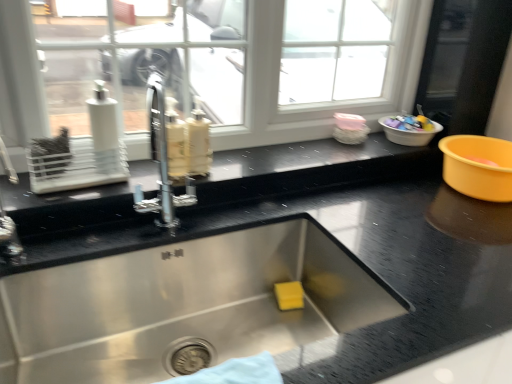
Locate an element on the screen. This screenshot has height=384, width=512. black granite countertop at center is located at coordinates (328, 230).

What do you see at coordinates (328, 230) in the screenshot? This screenshot has width=512, height=384. I see `black granite countertop at center` at bounding box center [328, 230].

Locate an element on the screen. This screenshot has height=384, width=512. white plastic basin at upper right is located at coordinates click(x=409, y=134).

What do you see at coordinates (409, 134) in the screenshot? I see `white plastic basin at upper right` at bounding box center [409, 134].

Identify the location of black granite countertop at center. Image resolution: width=512 pixels, height=384 pixels. (328, 230).

Considering the positions of objects black granite countertop at center and white plastic basin at upper right in the image provided, who is more to the right, black granite countertop at center or white plastic basin at upper right?

From the viewer's perspective, white plastic basin at upper right appears more on the right side.

Does black granite countertop at center come in front of white plastic basin at upper right?

That is True.

Considering the positions of points (304, 204) and (426, 136), is point (304, 204) closer to camera compared to point (426, 136)?

Yes.

From the image's perspective, which is above, black granite countertop at center or white plastic basin at upper right?

white plastic basin at upper right appears higher in the image.

From a real-world perspective, which is physically above, black granite countertop at center or white plastic basin at upper right?

From a 3D spatial view, white plastic basin at upper right is above.

Based on the photo, looking at their sizes, would you say black granite countertop at center is wider or thinner than white plastic basin at upper right?

Considering their sizes, black granite countertop at center looks broader than white plastic basin at upper right.

Considering the sizes of objects black granite countertop at center and white plastic basin at upper right in the image provided, who is shorter, black granite countertop at center or white plastic basin at upper right?

white plastic basin at upper right.

Looking at the image, does black granite countertop at center seem bigger or smaller compared to white plastic basin at upper right?

Considering their sizes, black granite countertop at center takes up more space than white plastic basin at upper right.

Would you say black granite countertop at center contains white plastic basin at upper right?

Actually, white plastic basin at upper right is outside black granite countertop at center.

Is black granite countertop at center far from white plastic basin at upper right?

black granite countertop at center is near white plastic basin at upper right, not far away.

Is black granite countertop at center facing away from white plastic basin at upper right?

No, black granite countertop at center is not facing away from white plastic basin at upper right.

How many degrees apart are the facing directions of black granite countertop at center and white plastic basin at upper right?

The angular difference between black granite countertop at center and white plastic basin at upper right is 0.895 degrees.

I want to click on countertop below the white plastic basin at upper right (from the image's perspective), so click(328, 230).

Is white plastic basin at upper right at the right side of black granite countertop at center?

Correct, you'll find white plastic basin at upper right to the right of black granite countertop at center.

From the picture: Considering the relative positions of white plastic basin at upper right and black granite countertop at center in the image provided, is white plastic basin at upper right in front of black granite countertop at center?

No.

Which is closer to the camera, (391, 140) or (28, 268)?

The point (28, 268) is closer.

Looking at this image, from the image's perspective, between white plastic basin at upper right and black granite countertop at center, who is located below?

black granite countertop at center.

From a real-world perspective, which is physically below, white plastic basin at upper right or black granite countertop at center?

black granite countertop at center.

Between white plastic basin at upper right and black granite countertop at center, which one has larger width?

Wider between the two is black granite countertop at center.

Who is taller, white plastic basin at upper right or black granite countertop at center?

With more height is black granite countertop at center.

In terms of size, does white plastic basin at upper right appear bigger or smaller than black granite countertop at center?

In the image, white plastic basin at upper right appears to be smaller than black granite countertop at center.

Is black granite countertop at center a part of white plastic basin at upper right?

No, black granite countertop at center is located outside of white plastic basin at upper right.

Is white plastic basin at upper right positioned far away from black granite countertop at center?

No, there isn't a large distance between white plastic basin at upper right and black granite countertop at center.

Could you tell me if white plastic basin at upper right is facing black granite countertop at center?

No.

Can you tell me how much white plastic basin at upper right and black granite countertop at center differ in facing direction?

white plastic basin at upper right and black granite countertop at center are facing 0.895 degrees away from each other.

Consider the image. Measure the distance between white plastic basin at upper right and black granite countertop at center.

white plastic basin at upper right is 18.12 inches away from black granite countertop at center.

I want to click on basin above the black granite countertop at center (from the image's perspective), so click(409, 134).

I want to click on countertop in front of the white plastic basin at upper right, so click(x=328, y=230).

The height and width of the screenshot is (384, 512). What are the coordinates of `countertop located on the left of white plastic basin at upper right` in the screenshot? It's located at (328, 230).